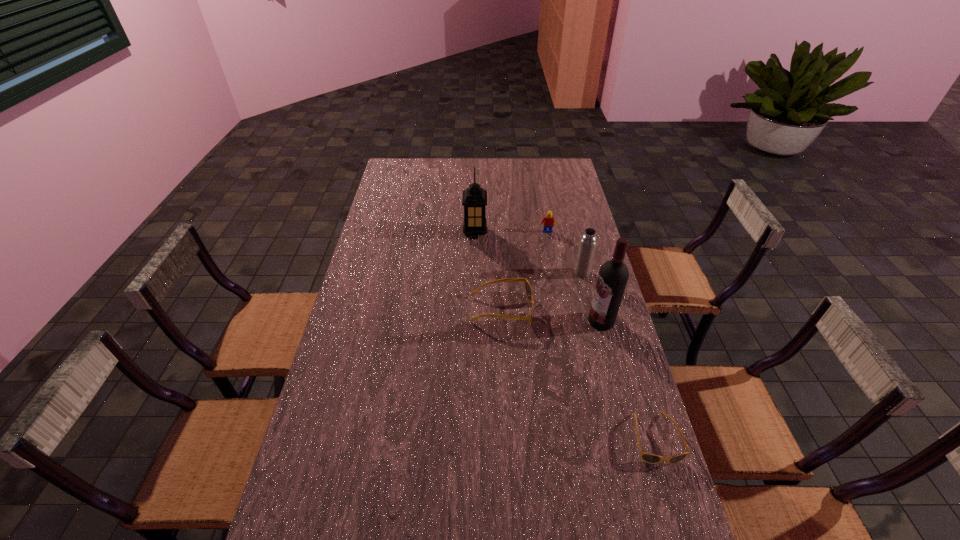
Find the location of `wine bottle present at the right edge`. wine bottle present at the right edge is located at coordinates (612, 279).

Where is `thermos bottle at the right edge`? The image size is (960, 540). thermos bottle at the right edge is located at coordinates (588, 242).

You are a GUI agent. You are given a task and a screenshot of the screen. Output one action in this format:
    pyautogui.click(x=<x>, y=<y>)
    Task: Click on the free space at the far edge
    This screenshot has height=540, width=960.
    Given the screenshot: What is the action you would take?
    pyautogui.click(x=537, y=165)

Where is `free space at the near edge of the desktop`? free space at the near edge of the desktop is located at coordinates (399, 528).

At what (x,y) coordinates should I click in order to perform the action: click on free space at the left edge. Please return your answer as a coordinate pair (x, y). The height and width of the screenshot is (540, 960). Looking at the image, I should click on (370, 332).

In order to click on vacant region at the right edge of the desktop in this screenshot , I will do `click(576, 225)`.

At what (x,y) coordinates should I click in order to perform the action: click on free space at the far left corner. Please return your answer as a coordinate pair (x, y). Looking at the image, I should click on (413, 165).

In the image, there is a desktop. Where is `vacant space at the far right corner`? vacant space at the far right corner is located at coordinates (552, 169).

Image resolution: width=960 pixels, height=540 pixels. Identify the location of free point between the fifth shortest object and the wine bottle. coord(539,277).

Identify the location of free space that is in between the shorter sunglasses and the thermos bottle. This screenshot has width=960, height=540. (618, 356).